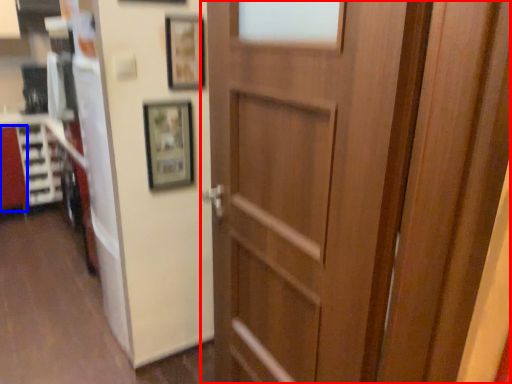
Question: Which point is closer to the camera, door (highlighted by a red box) or cabinetry (highlighted by a blue box)?

Choices:
 (A) door
 (B) cabinetry

Answer: (A)